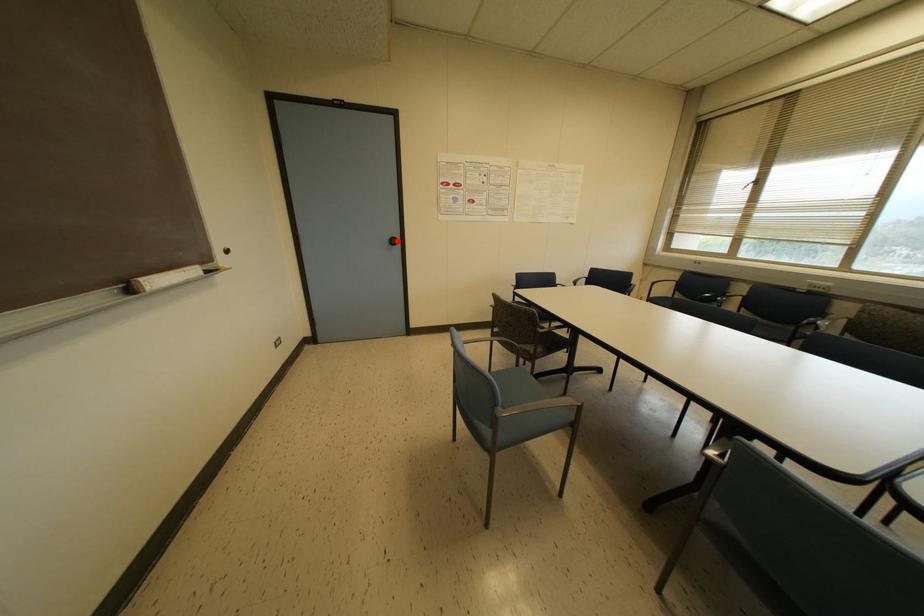
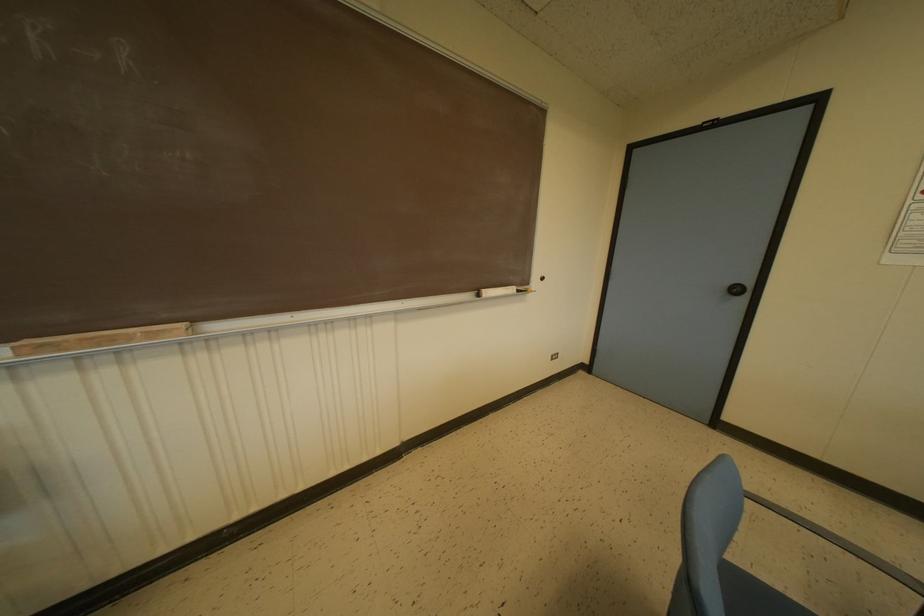
Where in the second image is the point corresponding to the highlighted location from the first image?

(746, 291)